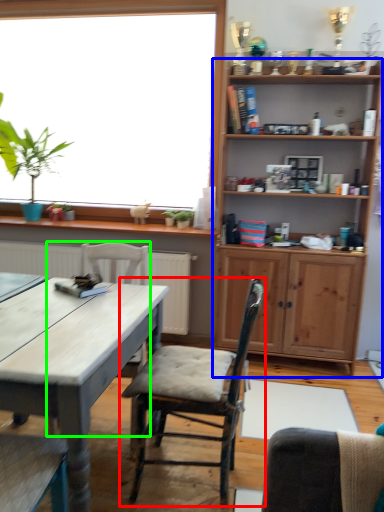
Question: Which object is positioned closest to chair (highlighted by a red box)? Select from shelf (highlighted by a blue box) and chair (highlighted by a green box).

Choices:
 (A) shelf
 (B) chair

Answer: (B)